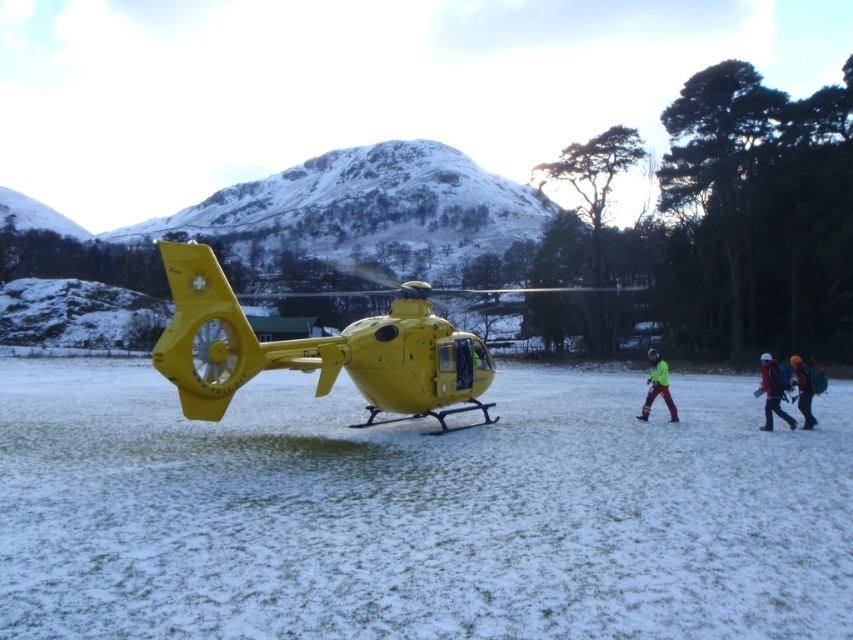
Question: Among these points, which one is farthest from the camera?

Choices:
 (A) (808, 410)
 (B) (775, 371)

Answer: (A)

Question: Does white powdery snow at center have a smaller size compared to orange knit hat at lower right?

Choices:
 (A) yes
 (B) no

Answer: (A)

Question: Which of the following is the closest to the observer?

Choices:
 (A) (796, 364)
 (B) (399, 358)

Answer: (B)

Question: Does reflective yellow jacket at center appear under orange knit hat at lower right?

Choices:
 (A) no
 (B) yes

Answer: (B)

Question: Does yellow matte helicopter at center appear on the left side of red fabric jacket at lower right?

Choices:
 (A) yes
 (B) no

Answer: (A)

Question: Which object is the closest to the white powdery snow at center?

Choices:
 (A) reflective yellow jacket at center
 (B) orange knit hat at lower right
 (C) red fabric jacket at lower right
 (D) yellow matte helicopter at center

Answer: (D)